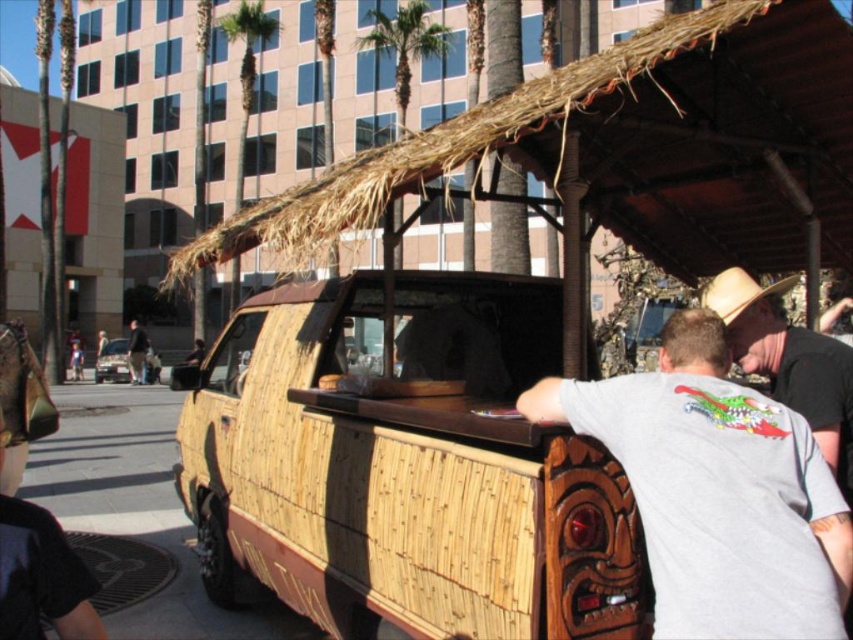
Question: Which point appears farthest from the camera in this image?

Choices:
 (A) (138, 378)
 (B) (848, 436)
 (C) (722, 312)
 (D) (416, 35)

Answer: (D)

Question: Is gray matte t-shirt at center bigger than metallic silver car at center?

Choices:
 (A) yes
 (B) no

Answer: (A)

Question: Which of these objects is positioned farthest from the metallic silver car at center?

Choices:
 (A) gray matte t-shirt at center
 (B) brown leather hat at right
 (C) bamboo van at center
 (D) light brown straw cowboy hat at upper right

Answer: (A)

Question: Can you confirm if light brown straw cowboy hat at upper right is thinner than dark gray shirt at center?

Choices:
 (A) yes
 (B) no

Answer: (A)

Question: Which of the following is the farthest from the observer?

Choices:
 (A) brown leather hat at right
 (B) metallic silver car at center
 (C) light brown straw cowboy hat at upper right

Answer: (B)

Question: Can you confirm if bamboo van at center is smaller than gray matte t-shirt at center?

Choices:
 (A) yes
 (B) no

Answer: (B)